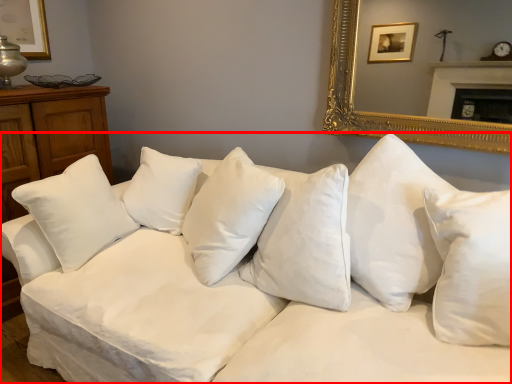
Question: In this image, where is studio couch (annotated by the red box) located relative to pillow?

Choices:
 (A) right
 (B) left

Answer: (A)